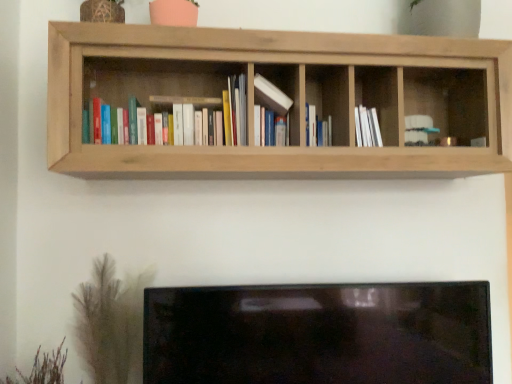
What do you see at coordinates (42, 368) in the screenshot?
I see `green grass at lower left, which ranks as the first plant in left-to-right order` at bounding box center [42, 368].

In order to face white paper at center, should I rotate leftwards or rightwards?

Rotate your view right by about 14.622°.

Find the location of a particular element. This screenshot has height=384, width=512. white matte book at center, which is the 2th book in left-to-right order is located at coordinates (273, 99).

Image resolution: width=512 pixels, height=384 pixels. Find the location of `brown textured plant at lower left, which is the second plant from left to right`. brown textured plant at lower left, which is the second plant from left to right is located at coordinates (109, 321).

Locate an element on the screen. The width and height of the screenshot is (512, 384). green grass at lower left, which ranks as the first plant in left-to-right order is located at coordinates (42, 368).

From a real-world perspective, is white paper book at center, placed as the 1th book when sorted from right to left, below matte hardcover books at left, placed as the 3th book when sorted from right to left?

Yes, from a real-world perspective, white paper book at center, placed as the 1th book when sorted from right to left, is beneath matte hardcover books at left, placed as the 3th book when sorted from right to left.

Is white paper book at center, acting as the 3th book starting from the left, facing towards matte hardcover books at left, placed as the 3th book when sorted from right to left?

No, white paper book at center, acting as the 3th book starting from the left, is not oriented towards matte hardcover books at left, placed as the 3th book when sorted from right to left.

Do you think white paper book at center, acting as the 3th book starting from the left, is within matte hardcover books at left, marked as the 1th book in a left-to-right arrangement, or outside of it?

white paper book at center, acting as the 3th book starting from the left, cannot be found inside matte hardcover books at left, marked as the 1th book in a left-to-right arrangement.

In terms of height, does white paper book at center, placed as the 1th book when sorted from right to left, look taller or shorter compared to matte hardcover books at left, marked as the 1th book in a left-to-right arrangement?

In the image, white paper book at center, placed as the 1th book when sorted from right to left, appears to be shorter than matte hardcover books at left, marked as the 1th book in a left-to-right arrangement.

Is matte hardcover books at left, marked as the 1th book in a left-to-right arrangement, spatially inside white paper at center, or outside of it?

matte hardcover books at left, marked as the 1th book in a left-to-right arrangement, is not enclosed by white paper at center.

The width and height of the screenshot is (512, 384). Find the location of `book that is the 2nd object above the white paper at center (from a real-world perspective)`. book that is the 2nd object above the white paper at center (from a real-world perspective) is located at coordinates (234, 111).

How different are the orientations of matte hardcover books at left, placed as the 3th book when sorted from right to left, and white paper at center in degrees?

The facing directions of matte hardcover books at left, placed as the 3th book when sorted from right to left, and white paper at center are 0.00122 degrees apart.

Consider the image. From a real-world perspective, is matte hardcover books at left, placed as the 3th book when sorted from right to left, on top of white paper at center?

Indeed, from a real-world perspective, matte hardcover books at left, placed as the 3th book when sorted from right to left, stands above white paper at center.

Considering the positions of points (62, 346) and (277, 109), is point (62, 346) farther from camera compared to point (277, 109)?

Yes, it is.

Which object is positioned more to the left, green grass at lower left, the second plant when ordered from right to left, or matte hardcover books at left, marked as the 1th book in a left-to-right arrangement?

green grass at lower left, the second plant when ordered from right to left.

From the image's perspective, which is above, green grass at lower left, the second plant when ordered from right to left, or matte hardcover books at left, marked as the 1th book in a left-to-right arrangement?

matte hardcover books at left, marked as the 1th book in a left-to-right arrangement, from the image's perspective.

How much distance is there between green grass at lower left, which ranks as the first plant in left-to-right order, and matte hardcover books at left, marked as the 1th book in a left-to-right arrangement?

95.40 centimeters.

At what (x,y) coordinates should I click in order to perform the action: click on plant that is the 2nd one below the natural wood shelf at upper center (from a real-world perspective). Please return your answer as a coordinate pair (x, y). Looking at the image, I should click on (42, 368).

Consider the image. From a real-world perspective, is green grass at lower left, which ranks as the first plant in left-to-right order, positioned above or below natural wood shelf at upper center?

From a real-world perspective, green grass at lower left, which ranks as the first plant in left-to-right order, is physically below natural wood shelf at upper center.

Is green grass at lower left, the second plant when ordered from right to left, taller than natural wood shelf at upper center?

Incorrect, the height of green grass at lower left, the second plant when ordered from right to left, is not larger of that of natural wood shelf at upper center.

Do you think green grass at lower left, which ranks as the first plant in left-to-right order, is within natural wood shelf at upper center, or outside of it?

The correct answer is: outside.

Is matte hardcover books at left, placed as the 3th book when sorted from right to left, not near green grass at lower left, which ranks as the first plant in left-to-right order?

No, matte hardcover books at left, placed as the 3th book when sorted from right to left, is not far away from green grass at lower left, which ranks as the first plant in left-to-right order.

The height and width of the screenshot is (384, 512). In order to click on book that is the 2nd one above the green grass at lower left, which ranks as the first plant in left-to-right order (from a real-world perspective) in this screenshot , I will do `click(234, 111)`.

Does matte hardcover books at left, placed as the 3th book when sorted from right to left, have a greater height compared to green grass at lower left, the second plant when ordered from right to left?

Yes, matte hardcover books at left, placed as the 3th book when sorted from right to left, is taller than green grass at lower left, the second plant when ordered from right to left.

Is white paper book at center, placed as the 1th book when sorted from right to left, at the left side of brown textured plant at lower left, the first plant from the right?

No, white paper book at center, placed as the 1th book when sorted from right to left, is not to the left of brown textured plant at lower left, the first plant from the right.

Is white paper book at center, acting as the 3th book starting from the left, positioned far away from brown textured plant at lower left, which is the second plant from left to right?

Actually, white paper book at center, acting as the 3th book starting from the left, and brown textured plant at lower left, which is the second plant from left to right, are a little close together.

Who is bigger, white paper book at center, acting as the 3th book starting from the left, or brown textured plant at lower left, which is the second plant from left to right?

Bigger between the two is brown textured plant at lower left, which is the second plant from left to right.

Based on the photo, could you tell me if white paper book at center, placed as the 1th book when sorted from right to left, is turned towards brown textured plant at lower left, the first plant from the right?

No, white paper book at center, placed as the 1th book when sorted from right to left, is not oriented towards brown textured plant at lower left, the first plant from the right.

Considering the points (325, 125) and (18, 375), which point is behind, point (325, 125) or point (18, 375)?

The point (325, 125) is behind.

Which of these two, white paper book at center, acting as the 3th book starting from the left, or green grass at lower left, the second plant when ordered from right to left, is bigger?

green grass at lower left, the second plant when ordered from right to left, is bigger.

From the picture: From a real-world perspective, is white paper book at center, placed as the 1th book when sorted from right to left, positioned above or below green grass at lower left, which ranks as the first plant in left-to-right order?

white paper book at center, placed as the 1th book when sorted from right to left, is above green grass at lower left, which ranks as the first plant in left-to-right order.

This screenshot has height=384, width=512. What are the coordinates of `book below the matte hardcover books at left, marked as the 1th book in a left-to-right arrangement (from the image's perspective)` in the screenshot? It's located at (317, 128).

At what (x,y) coordinates should I click in order to perform the action: click on cabinet below the matte hardcover books at left, placed as the 3th book when sorted from right to left (from a real-world perspective). Please return your answer as a coordinate pair (x, y). The height and width of the screenshot is (384, 512). Looking at the image, I should click on (380, 98).

Estimate the real-world distances between objects in this image. Which object is closer to green grass at lower left, the second plant when ordered from right to left, white paper book at center, placed as the 1th book when sorted from right to left, or matte hardcover books at left, placed as the 3th book when sorted from right to left?

Among the two, matte hardcover books at left, placed as the 3th book when sorted from right to left, is located nearer to green grass at lower left, the second plant when ordered from right to left.

Based on their spatial positions, is white paper at center or white matte book at center, which is the 2th book in left-to-right order, further from green grass at lower left, the second plant when ordered from right to left?

white paper at center lies further to green grass at lower left, the second plant when ordered from right to left, than the other object.

When comparing their distances from green grass at lower left, the second plant when ordered from right to left, does natural wood shelf at upper center or white paper book at center, placed as the 1th book when sorted from right to left, seem further?

Among the two, white paper book at center, placed as the 1th book when sorted from right to left, is located further to green grass at lower left, the second plant when ordered from right to left.

When comparing their distances from white paper book at center, acting as the 3th book starting from the left, does natural wood shelf at upper center or green grass at lower left, which ranks as the first plant in left-to-right order, seem further?

green grass at lower left, which ranks as the first plant in left-to-right order, lies further to white paper book at center, acting as the 3th book starting from the left, than the other object.

Which object lies nearer to the anchor point white paper book at center, placed as the 1th book when sorted from right to left, natural wood shelf at upper center or matte hardcover books at left, marked as the 1th book in a left-to-right arrangement?

matte hardcover books at left, marked as the 1th book in a left-to-right arrangement.

Looking at the image, which one is located further to natural wood shelf at upper center, white matte book at center, which is the 2th book in left-to-right order, or white paper at center?

white matte book at center, which is the 2th book in left-to-right order.

From the image, which object appears to be nearer to brown textured plant at lower left, which is the second plant from left to right, white paper book at center, placed as the 1th book when sorted from right to left, or matte hardcover books at left, marked as the 1th book in a left-to-right arrangement?

matte hardcover books at left, marked as the 1th book in a left-to-right arrangement, is closer to brown textured plant at lower left, which is the second plant from left to right.

Based on their spatial positions, is white paper at center or matte hardcover books at left, placed as the 3th book when sorted from right to left, closer to green grass at lower left, which ranks as the first plant in left-to-right order?

matte hardcover books at left, placed as the 3th book when sorted from right to left.

Find the location of a particular element. The height and width of the screenshot is (384, 512). book between white matte book at center, acting as the 2th book starting from the right, and white paper at center from left to right is located at coordinates (317, 128).

At what (x,y) coordinates should I click in order to perform the action: click on shelf located between white matte book at center, which is the 2th book in left-to-right order, and white paper at center in the left-right direction. Please return your answer as a coordinate pair (x, y). Looking at the image, I should click on (285, 93).

You are a GUI agent. You are given a task and a screenshot of the screen. Output one action in this format:
    pyautogui.click(x=<x>, y=<y>)
    Task: Click on the shelf located between matte hardcover books at left, placed as the 3th book when sorted from right to left, and white paper book at center, placed as the 1th book when sorted from right to left, in the left-right direction
    The image size is (512, 384).
    Given the screenshot: What is the action you would take?
    pyautogui.click(x=285, y=93)

Where is `book between matte hardcover books at left, placed as the 3th book when sorted from right to left, and green grass at lower left, the second plant when ordered from right to left, in the up-down direction`? Image resolution: width=512 pixels, height=384 pixels. book between matte hardcover books at left, placed as the 3th book when sorted from right to left, and green grass at lower left, the second plant when ordered from right to left, in the up-down direction is located at coordinates (317, 128).